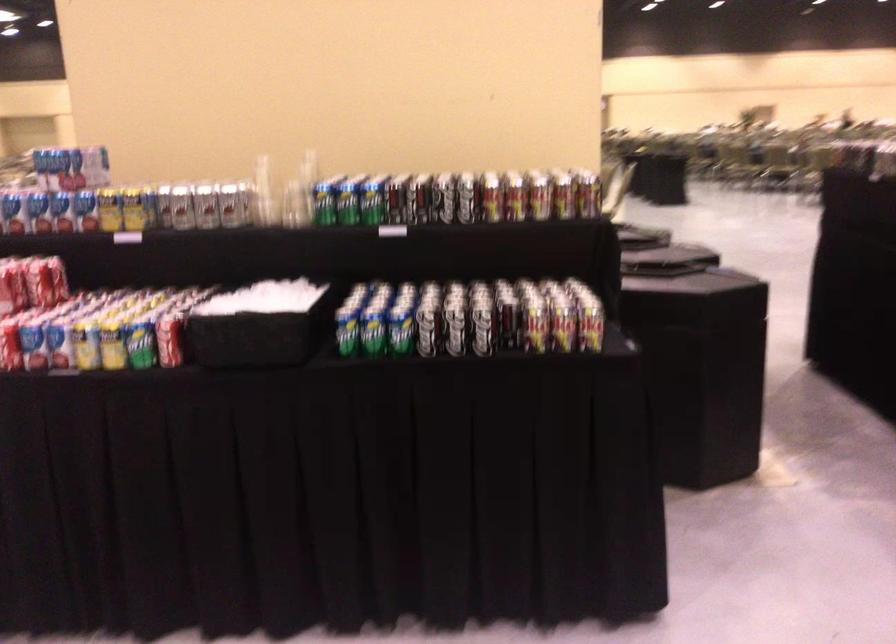
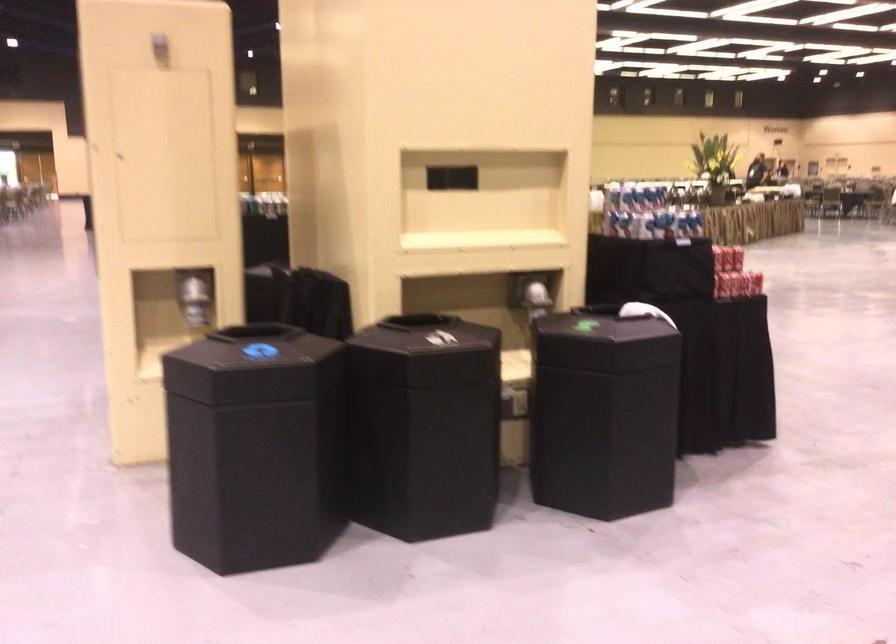
Question: I am providing you with two images of the same scene from different viewpoints. Which of the following objects are not visible in image2?

Choices:
 (A) black bin lid
 (B) storage cube handle
 (C) shiny dispenser lever
 (D) yellow soda can

Answer: (D)